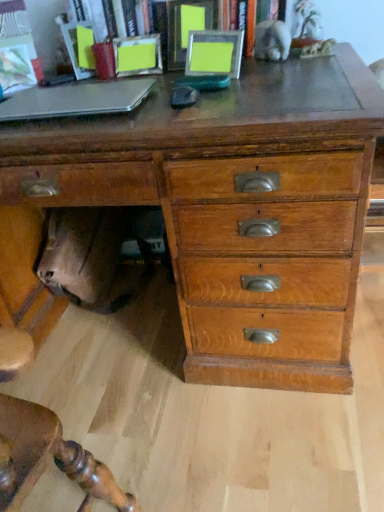
Where is `free space in front of metallic silver photo frames at upper center`? Image resolution: width=384 pixels, height=512 pixels. free space in front of metallic silver photo frames at upper center is located at coordinates (237, 90).